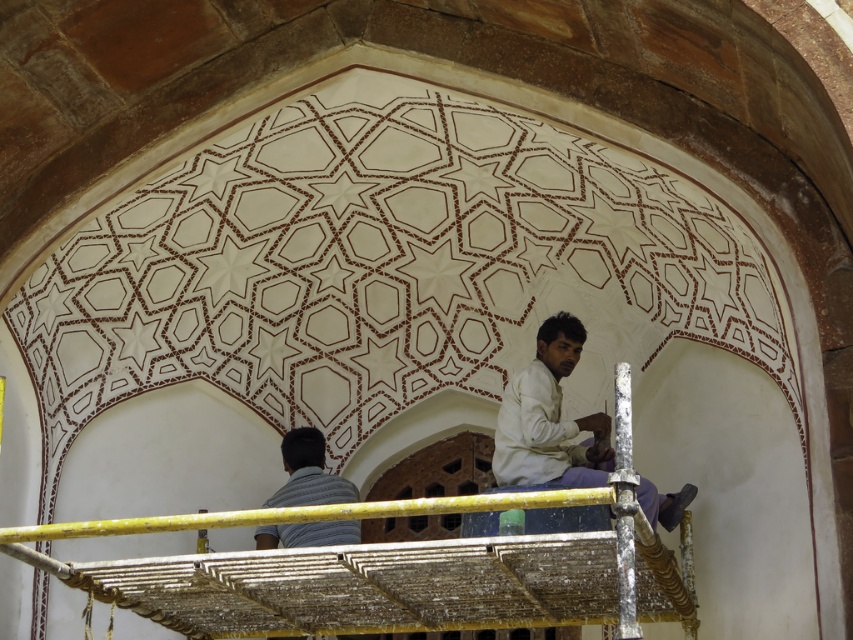
Question: Is white cotton shirt at center bigger than striped cotton shirt at lower center?

Choices:
 (A) yes
 (B) no

Answer: (A)

Question: Does white cotton shirt at center appear under striped cotton shirt at lower center?

Choices:
 (A) yes
 (B) no

Answer: (B)

Question: Which object is farther from the camera taking this photo?

Choices:
 (A) white cotton shirt at center
 (B) striped cotton shirt at lower center

Answer: (B)

Question: Which of the following is the closest to the observer?

Choices:
 (A) (605, 472)
 (B) (306, 454)

Answer: (A)

Question: Does white cotton shirt at center appear under striped cotton shirt at lower center?

Choices:
 (A) no
 (B) yes

Answer: (A)